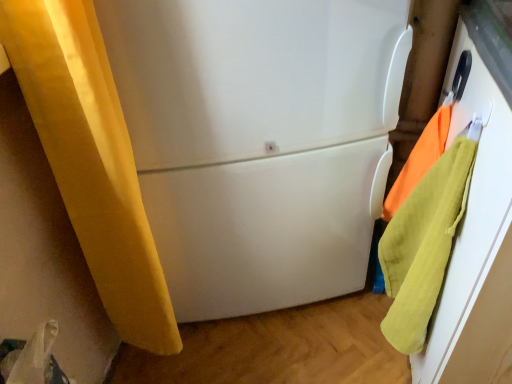
What is the approximate width of white glossy refrigerator at center?

19.42 inches.

Describe the element at coordinates (419, 160) in the screenshot. I see `orange cotton towel at right, which appears as the 2th beach towel when ordered from the bottom` at that location.

Where is `soft yellow towel at right, positioned as the first beach towel in bottom-to-top order`? The image size is (512, 384). soft yellow towel at right, positioned as the first beach towel in bottom-to-top order is located at coordinates pos(423,245).

Is white glossy refrigerator at center next to soft yellow towel at right, marked as the second beach towel in a top-to-bottom arrangement?

They are not placed beside each other.

Is point (345, 241) closer to camera compared to point (458, 154)?

That is False.

From a real-world perspective, who is located higher, white glossy refrigerator at center or soft yellow towel at right, positioned as the first beach towel in bottom-to-top order?

In real-world perspective, white glossy refrigerator at center is above.

Could you tell me if white glossy refrigerator at center is turned towards soft yellow towel at right, positioned as the first beach towel in bottom-to-top order?

Yes, white glossy refrigerator at center is facing soft yellow towel at right, positioned as the first beach towel in bottom-to-top order.

Is soft yellow towel at right, marked as the second beach towel in a top-to-bottom arrangement, oriented away from orange cotton towel at right, which is the 1th beach towel from top to bottom?

Absolutely, soft yellow towel at right, marked as the second beach towel in a top-to-bottom arrangement, is directed away from orange cotton towel at right, which is the 1th beach towel from top to bottom.

Is soft yellow towel at right, positioned as the first beach towel in bottom-to-top order, to the right of orange cotton towel at right, which appears as the 2th beach towel when ordered from the bottom, from the viewer's perspective?

No.

Can you see soft yellow towel at right, positioned as the first beach towel in bottom-to-top order, touching orange cotton towel at right, which is the 1th beach towel from top to bottom?

There is a gap between soft yellow towel at right, positioned as the first beach towel in bottom-to-top order, and orange cotton towel at right, which is the 1th beach towel from top to bottom.

The width and height of the screenshot is (512, 384). What are the coordinates of `beach towel below the orange cotton towel at right, which is the 1th beach towel from top to bottom (from the image's perspective)` in the screenshot? It's located at (423, 245).

Considering the sizes of objects orange cotton towel at right, which is the 1th beach towel from top to bottom, and soft yellow towel at right, positioned as the first beach towel in bottom-to-top order, in the image provided, who is bigger, orange cotton towel at right, which is the 1th beach towel from top to bottom, or soft yellow towel at right, positioned as the first beach towel in bottom-to-top order,?

soft yellow towel at right, positioned as the first beach towel in bottom-to-top order.

Is orange cotton towel at right, which is the 1th beach towel from top to bottom, not close to soft yellow towel at right, positioned as the first beach towel in bottom-to-top order?

No, orange cotton towel at right, which is the 1th beach towel from top to bottom, is not far away from soft yellow towel at right, positioned as the first beach towel in bottom-to-top order.

The image size is (512, 384). In the image, there is a soft yellow towel at right, positioned as the first beach towel in bottom-to-top order. Identify the location of beach towel above it (from the image's perspective). (419, 160).

How much distance is there between orange cotton towel at right, which appears as the 2th beach towel when ordered from the bottom, and soft yellow towel at right, marked as the second beach towel in a top-to-bottom arrangement?

5.34 inches.

From the image's perspective, which one is positioned higher, orange cotton towel at right, which appears as the 2th beach towel when ordered from the bottom, or white glossy refrigerator at center?

white glossy refrigerator at center is shown above in the image.

Considering the sizes of objects orange cotton towel at right, which is the 1th beach towel from top to bottom, and white glossy refrigerator at center in the image provided, who is taller, orange cotton towel at right, which is the 1th beach towel from top to bottom, or white glossy refrigerator at center?

white glossy refrigerator at center.

Between orange cotton towel at right, which appears as the 2th beach towel when ordered from the bottom, and white glossy refrigerator at center, which one has smaller size?

orange cotton towel at right, which appears as the 2th beach towel when ordered from the bottom, is smaller.

Is point (443, 149) positioned in front of point (155, 107)?

No, it is not.

From a real-world perspective, is white glossy refrigerator at center physically below orange cotton towel at right, which appears as the 2th beach towel when ordered from the bottom?

Yes, from a real-world perspective, white glossy refrigerator at center is under orange cotton towel at right, which appears as the 2th beach towel when ordered from the bottom.

From the picture: Considering the positions of objects white glossy refrigerator at center and orange cotton towel at right, which is the 1th beach towel from top to bottom, in the image provided, who is in front, white glossy refrigerator at center or orange cotton towel at right, which is the 1th beach towel from top to bottom,?

white glossy refrigerator at center is in front.

Looking at this image, is white glossy refrigerator at center far away from orange cotton towel at right, which appears as the 2th beach towel when ordered from the bottom?

No.

How many degrees apart are the facing directions of soft yellow towel at right, marked as the second beach towel in a top-to-bottom arrangement, and white glossy refrigerator at center?

They differ by 17.7 degrees in their facing directions.

I want to click on refrigerator on the left of soft yellow towel at right, marked as the second beach towel in a top-to-bottom arrangement, so click(259, 141).

In the scene shown: From a real-world perspective, relative to white glossy refrigerator at center, is soft yellow towel at right, marked as the second beach towel in a top-to-bottom arrangement, vertically above or below?

Clearly, from a real-world perspective, soft yellow towel at right, marked as the second beach towel in a top-to-bottom arrangement, is below white glossy refrigerator at center.

Is white glossy refrigerator at center inside soft yellow towel at right, positioned as the first beach towel in bottom-to-top order?

No, white glossy refrigerator at center is not inside soft yellow towel at right, positioned as the first beach towel in bottom-to-top order.

Locate an element on the screen. The width and height of the screenshot is (512, 384). the 1st beach towel counting from the right of the white glossy refrigerator at center is located at coordinates (423, 245).

Identify the location of beach towel that is under the orange cotton towel at right, which is the 1th beach towel from top to bottom (from a real-world perspective). (423, 245).

When comparing their distances from white glossy refrigerator at center, does orange cotton towel at right, which is the 1th beach towel from top to bottom, or soft yellow towel at right, marked as the second beach towel in a top-to-bottom arrangement, seem further?

orange cotton towel at right, which is the 1th beach towel from top to bottom, is positioned further to the anchor white glossy refrigerator at center.

Based on their spatial positions, is soft yellow towel at right, marked as the second beach towel in a top-to-bottom arrangement, or orange cotton towel at right, which appears as the 2th beach towel when ordered from the bottom, closer to white glossy refrigerator at center?

Based on the image, soft yellow towel at right, marked as the second beach towel in a top-to-bottom arrangement, appears to be nearer to white glossy refrigerator at center.

Looking at the image, which one is located closer to soft yellow towel at right, marked as the second beach towel in a top-to-bottom arrangement, orange cotton towel at right, which appears as the 2th beach towel when ordered from the bottom, or white glossy refrigerator at center?

orange cotton towel at right, which appears as the 2th beach towel when ordered from the bottom, is closer to soft yellow towel at right, marked as the second beach towel in a top-to-bottom arrangement.

From the picture: Looking at the image, which one is located further to soft yellow towel at right, marked as the second beach towel in a top-to-bottom arrangement, white glossy refrigerator at center or orange cotton towel at right, which appears as the 2th beach towel when ordered from the bottom?

Based on the image, white glossy refrigerator at center appears to be further to soft yellow towel at right, marked as the second beach towel in a top-to-bottom arrangement.

Based on their spatial positions, is white glossy refrigerator at center or soft yellow towel at right, positioned as the first beach towel in bottom-to-top order, closer to orange cotton towel at right, which is the 1th beach towel from top to bottom?

soft yellow towel at right, positioned as the first beach towel in bottom-to-top order, is positioned closer to the anchor orange cotton towel at right, which is the 1th beach towel from top to bottom.

When comparing their distances from orange cotton towel at right, which appears as the 2th beach towel when ordered from the bottom, does soft yellow towel at right, marked as the second beach towel in a top-to-bottom arrangement, or white glossy refrigerator at center seem further?

Based on the image, white glossy refrigerator at center appears to be further to orange cotton towel at right, which appears as the 2th beach towel when ordered from the bottom.

Locate an element on the screen. The height and width of the screenshot is (384, 512). beach towel between white glossy refrigerator at center and orange cotton towel at right, which appears as the 2th beach towel when ordered from the bottom is located at coordinates (423, 245).